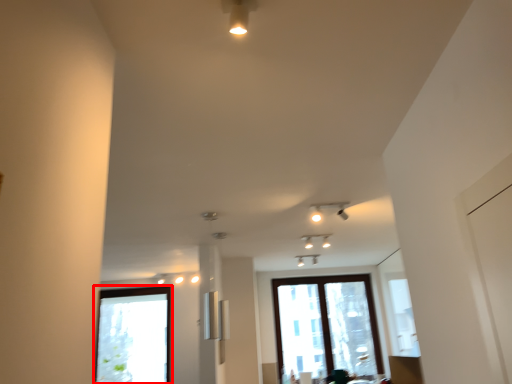
Question: From the image's perspective, what is the correct spatial positioning of window (annotated by the red box) in reference to window?

Choices:
 (A) below
 (B) above

Answer: (A)